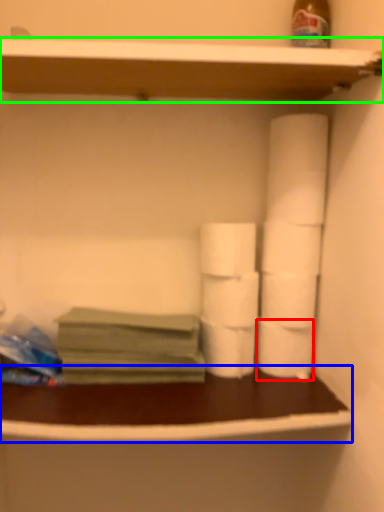
Question: Which object is positioned farthest from toilet paper (highlighted by a red box)? Select from counter (highlighted by a blue box) and shelf (highlighted by a green box).

Choices:
 (A) counter
 (B) shelf

Answer: (B)